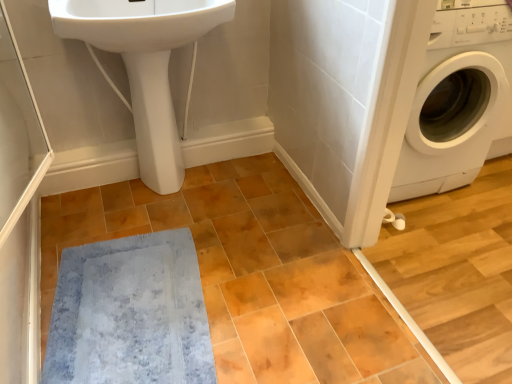
Question: Is point (117, 31) closer or farther from the camera than point (428, 125)?

Choices:
 (A) farther
 (B) closer

Answer: (B)

Question: Considering the positions of white glossy sink at upper left and white glossy washing machine at right in the image, is white glossy sink at upper left bigger or smaller than white glossy washing machine at right?

Choices:
 (A) small
 (B) big

Answer: (A)

Question: Which is nearer to the white glossy bidet at lower left?

Choices:
 (A) blue plush bath mat at lower left
 (B) white glossy washing machine at right
 (C) white glossy sink at upper left

Answer: (C)

Question: Estimate the real-world distances between objects in this image. Which object is farther from the white glossy bidet at lower left?

Choices:
 (A) white glossy washing machine at right
 (B) white glossy sink at upper left
 (C) blue plush bath mat at lower left

Answer: (A)